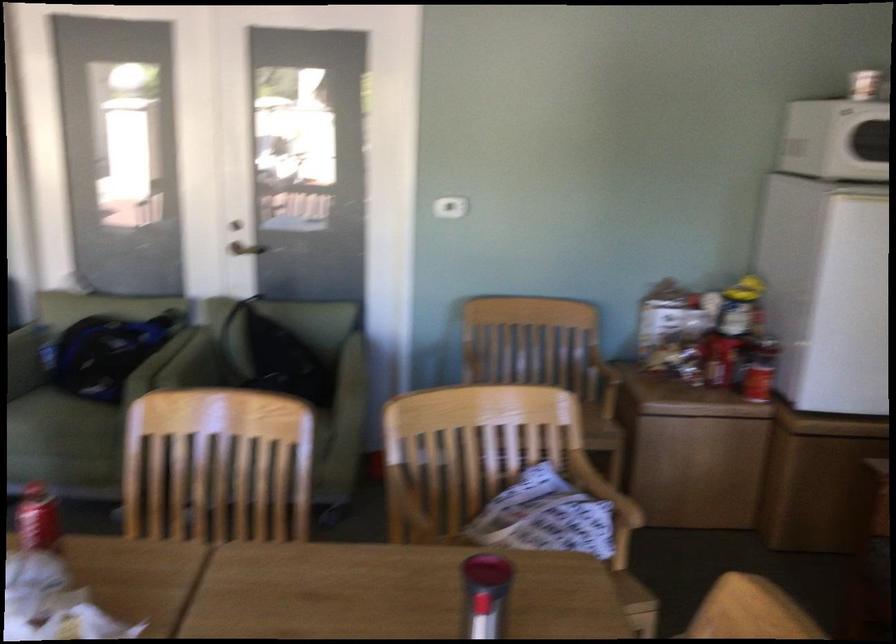
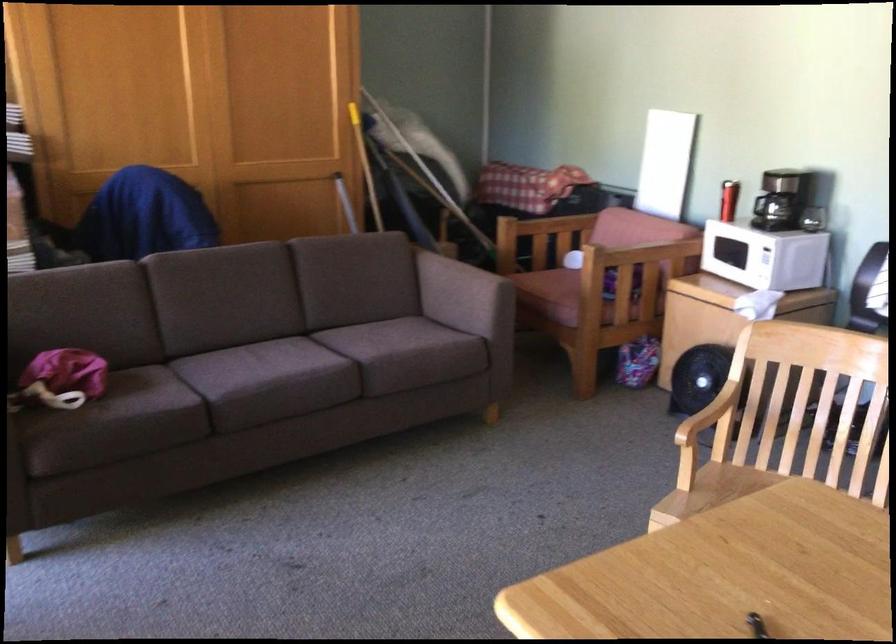
Question: The first image is from the beginning of the video and the second image is from the end. How did the camera likely rotate when shooting the video?

Choices:
 (A) Left
 (B) Right
 (C) Up
 (D) Down

Answer: (A)